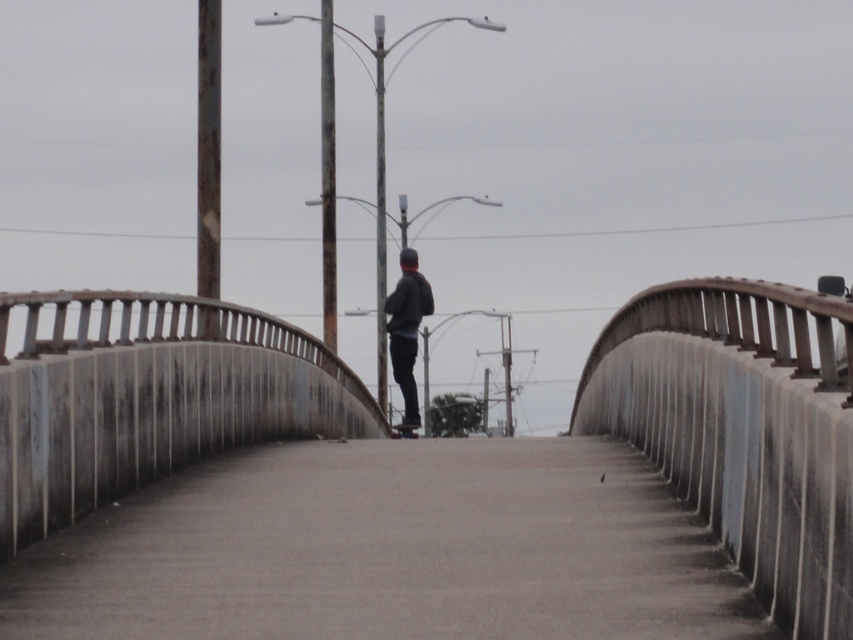
Does smooth concrete railing at center appear under dark gray matte skateboard at center?

Incorrect, smooth concrete railing at center is not positioned below dark gray matte skateboard at center.

Who is lower down, smooth concrete railing at center or dark gray matte skateboard at center?

dark gray matte skateboard at center is lower down.

I want to click on smooth concrete railing at center, so click(741, 429).

Is smooth concrete path at center to the right of dark gray sweater at center from the viewer's perspective?

Correct, you'll find smooth concrete path at center to the right of dark gray sweater at center.

This screenshot has height=640, width=853. What do you see at coordinates (389, 550) in the screenshot? I see `smooth concrete path at center` at bounding box center [389, 550].

Where is `smooth concrete path at center`? The image size is (853, 640). smooth concrete path at center is located at coordinates (389, 550).

Who is more distant from viewer, (393, 316) or (405, 433)?

Positioned behind is point (405, 433).

Is point (389, 330) closer to camera compared to point (416, 422)?

Yes, it is.

Is point (407, 253) closer to viewer compared to point (399, 433)?

Yes, it is.

Identify the location of dark gray sweater at center. (405, 326).